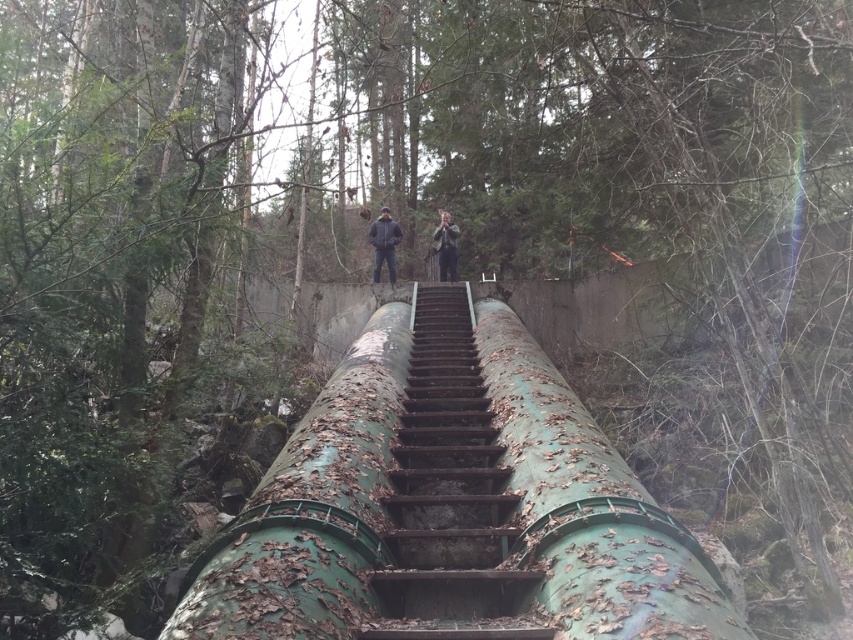
Question: Based on their relative distances, which object is nearer to the green mossy pipe at center?

Choices:
 (A) green rusted water pipe at center
 (B) dark gray jacket at center

Answer: (B)

Question: Does rusty metal stairs at center have a larger size compared to green mossy pipe at center?

Choices:
 (A) no
 (B) yes

Answer: (B)

Question: In this image, where is rusty metal stairs at center located relative to green mossy pipe at center?

Choices:
 (A) left
 (B) right

Answer: (B)

Question: Can you confirm if green rusted water pipe at center is smaller than dark gray jacket at center?

Choices:
 (A) yes
 (B) no

Answer: (B)

Question: Considering the real-world distances, which object is closest to the rusty metal stairs at center?

Choices:
 (A) green mossy pipe at center
 (B) green rusted water pipe at center
 (C) dark gray jacket at center

Answer: (B)

Question: Which point is farther from the camera taking this photo?

Choices:
 (A) (402, 497)
 (B) (387, 269)
 (C) (451, 241)

Answer: (B)